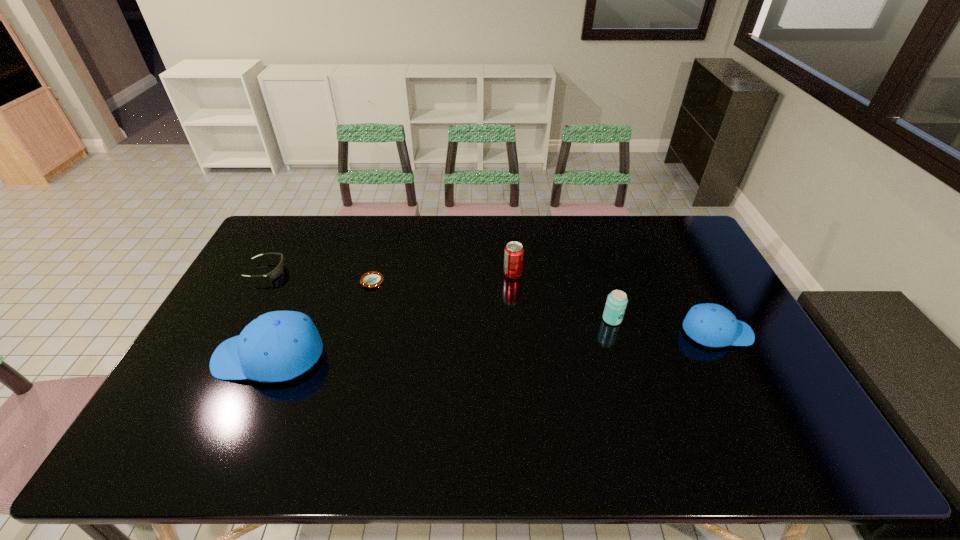
Please determine a free point for an extra cap_(headwear) to ensure balance. Please provide its 2D coordinates. Your answer should be formatted as a tuple, i.e. [(x, y)], where the tuple contains the x and y coordinates of a point satisfying the conditions above.

[(499, 344)]